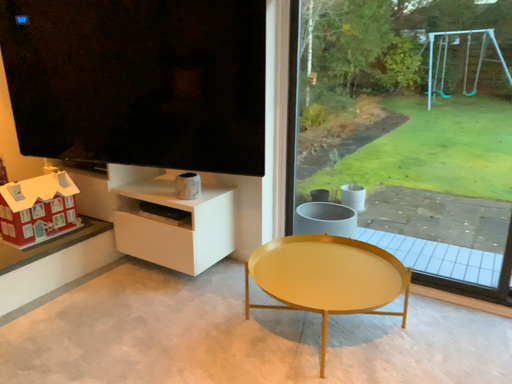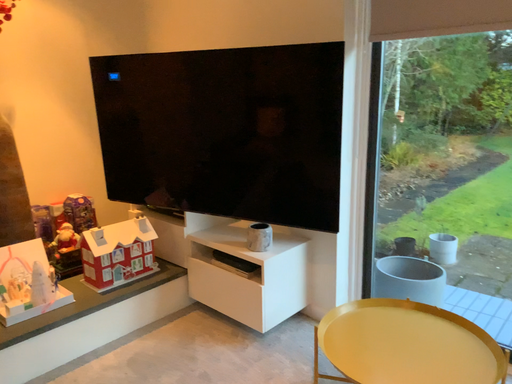
Question: Which way did the camera rotate in the video?

Choices:
 (A) rotated left
 (B) rotated right

Answer: (A)